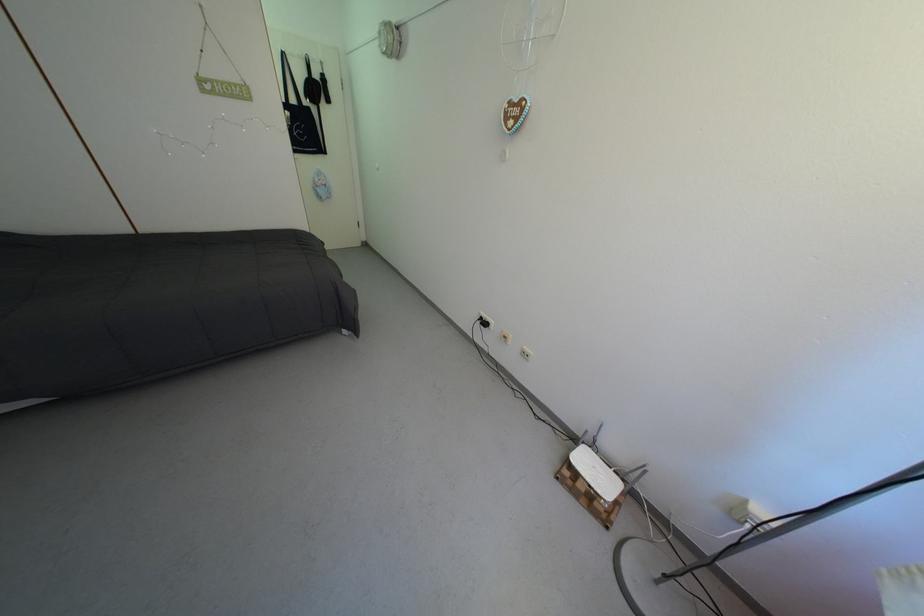
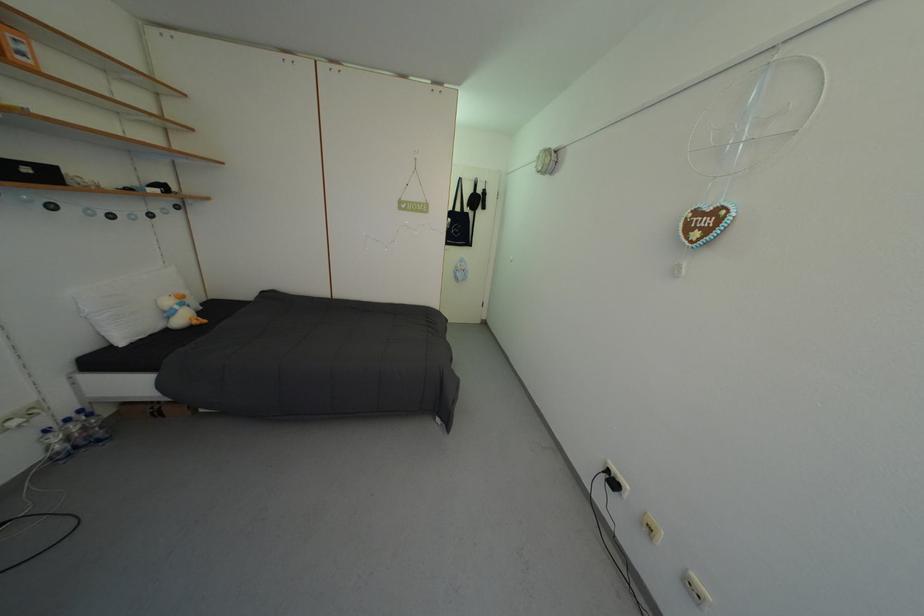
Where in the second image is the point corresponding to the point at 490,323 from the first image?

(616, 477)